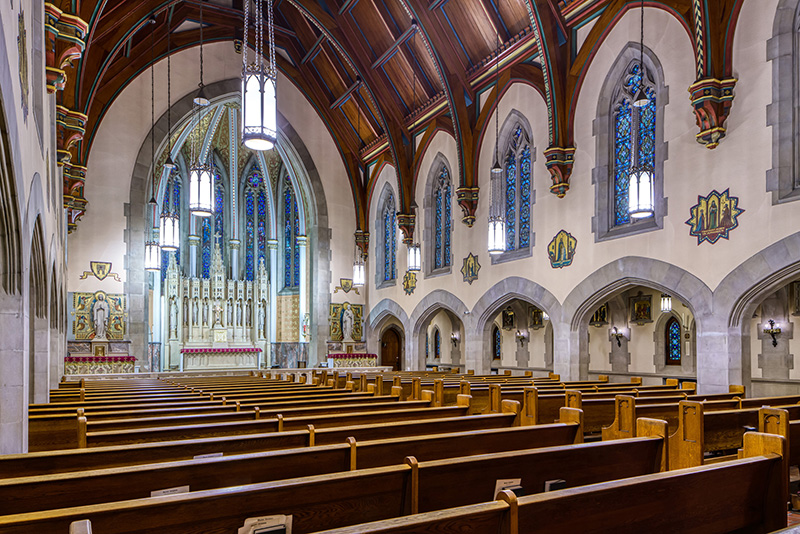
Where is `wall sconce lights`? The image size is (800, 534). wall sconce lights is located at coordinates (772, 321), (618, 331), (518, 332), (454, 335).